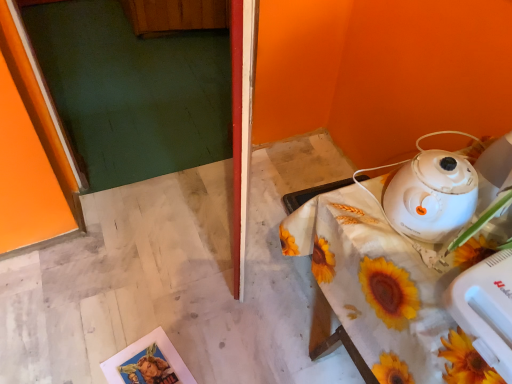
Question: From a real-world perspective, is white glossy kettle at upper right physically above white plastic mixer at lower right?

Choices:
 (A) yes
 (B) no

Answer: (A)

Question: Is white glossy kettle at upper right not close to white plastic mixer at lower right?

Choices:
 (A) yes
 (B) no

Answer: (B)

Question: From a real-world perspective, is white glossy kettle at upper right physically below white plastic mixer at lower right?

Choices:
 (A) yes
 (B) no

Answer: (B)

Question: Is white glossy kettle at upper right aimed at white plastic mixer at lower right?

Choices:
 (A) yes
 (B) no

Answer: (B)

Question: Does white glossy kettle at upper right have a smaller size compared to white plastic mixer at lower right?

Choices:
 (A) no
 (B) yes

Answer: (B)

Question: Relative to white fabric-covered table at lower right, is white plastic mixer at lower right in front or behind?

Choices:
 (A) front
 (B) behind

Answer: (A)

Question: Is white plastic mixer at lower right bigger or smaller than white fabric-covered table at lower right?

Choices:
 (A) big
 (B) small

Answer: (B)

Question: Is point (493, 347) closer or farther from the camera than point (372, 322)?

Choices:
 (A) closer
 (B) farther

Answer: (A)

Question: Choose the correct answer: Is white plastic mixer at lower right inside white fabric-covered table at lower right or outside it?

Choices:
 (A) inside
 (B) outside

Answer: (B)

Question: From the image's perspective, is white fabric-covered table at lower right above or below white glossy kettle at upper right?

Choices:
 (A) below
 (B) above

Answer: (A)

Question: From their relative heights in the image, would you say white fabric-covered table at lower right is taller or shorter than white glossy kettle at upper right?

Choices:
 (A) tall
 (B) short

Answer: (A)

Question: Is point (352, 241) positioned closer to the camera than point (429, 208)?

Choices:
 (A) closer
 (B) farther

Answer: (B)

Question: In the image, is white fabric-covered table at lower right positioned in front of or behind white glossy kettle at upper right?

Choices:
 (A) front
 (B) behind

Answer: (A)

Question: From a real-world perspective, is white plastic mixer at lower right positioned above or below white glossy kettle at upper right?

Choices:
 (A) above
 (B) below

Answer: (B)

Question: From the image's perspective, is white plastic mixer at lower right positioned above or below white glossy kettle at upper right?

Choices:
 (A) below
 (B) above

Answer: (A)